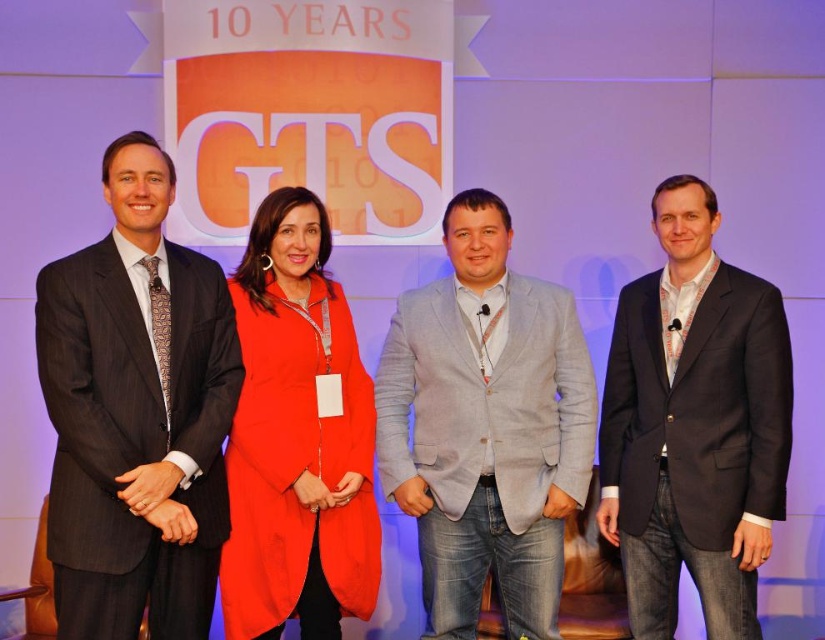
You are a photographer at the event and need to adjust the camera angle so that both the gray linen blazer at center and the dark gray suit at right are in frame. Given their height difference, which person should you focus on first to ensure both are visible?

The gray linen blazer at center is not as tall as the dark gray suit at right, so you should focus on the taller dark gray suit at right first to ensure both are visible in the frame.

In the scene shown: You are standing in front of the stage at the 10 years GTS event. You see two points marked on the stage floor. The first point is at coordinate point (173,436) and the second is at point (274,269). Which point is closer to you?

Point (173,436) is closer to the viewer than point (274,269).

You are a photographer at the event and need to capture a photo of both the dark gray pinstripe suit at left and the matte orange coat at center. The minimum distance required between subjects for clear focus is 30 centimeters. Can you take the photo without moving either subject?

The dark gray pinstripe suit at left is 30.98 centimeters away from the matte orange coat at center. Since the required minimum distance is 30 centimeters, the photographer can take the photo without moving the subjects as the distance is sufficient.